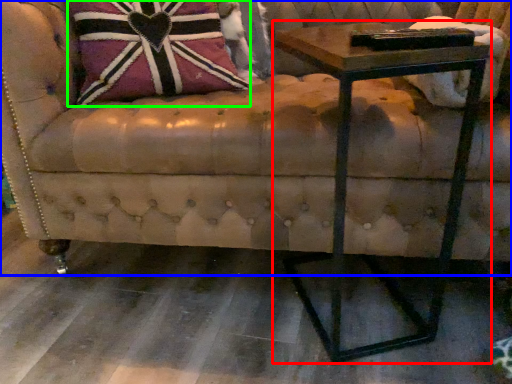
Question: Based on their relative distances, which object is nearer to table (highlighted by a red box)? Choose from studio couch (highlighted by a blue box) and throw pillow (highlighted by a green box).

Choices:
 (A) studio couch
 (B) throw pillow

Answer: (A)